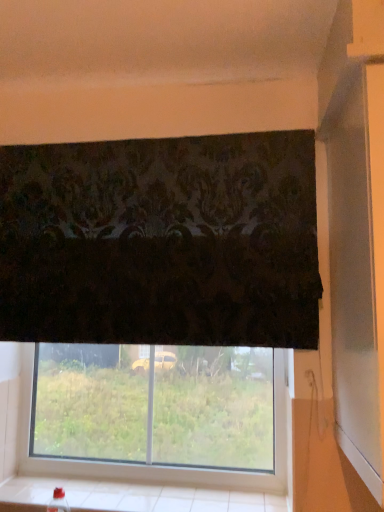
Question: From the image's perspective, is transparent glass window at lower center under white tile at lower center?

Choices:
 (A) yes
 (B) no

Answer: (B)

Question: Does transparent glass window at lower center have a larger size compared to white tile at lower center?

Choices:
 (A) no
 (B) yes

Answer: (B)

Question: From the image's perspective, is transparent glass window at lower center above white tile at lower center?

Choices:
 (A) no
 (B) yes

Answer: (B)

Question: Is transparent glass window at lower center wider than white tile at lower center?

Choices:
 (A) yes
 (B) no

Answer: (B)

Question: Is transparent glass window at lower center facing away from white tile at lower center?

Choices:
 (A) yes
 (B) no

Answer: (B)

Question: Does transparent glass window at lower center contain white tile at lower center?

Choices:
 (A) yes
 (B) no

Answer: (B)

Question: Is white tile at lower center not near transparent glass window at lower center?

Choices:
 (A) no
 (B) yes

Answer: (A)

Question: Is the position of white tile at lower center less distant than that of transparent glass window at lower center?

Choices:
 (A) no
 (B) yes

Answer: (B)

Question: Does white tile at lower center turn towards transparent glass window at lower center?

Choices:
 (A) yes
 (B) no

Answer: (B)

Question: Can you see white tile at lower center touching transparent glass window at lower center?

Choices:
 (A) no
 (B) yes

Answer: (B)

Question: Considering the relative sizes of white tile at lower center and transparent glass window at lower center in the image provided, is white tile at lower center bigger than transparent glass window at lower center?

Choices:
 (A) yes
 (B) no

Answer: (B)

Question: Does white tile at lower center have a greater height compared to transparent glass window at lower center?

Choices:
 (A) no
 (B) yes

Answer: (A)

Question: Looking at the image, does white tile at lower center seem bigger or smaller compared to transparent glass window at lower center?

Choices:
 (A) small
 (B) big

Answer: (A)